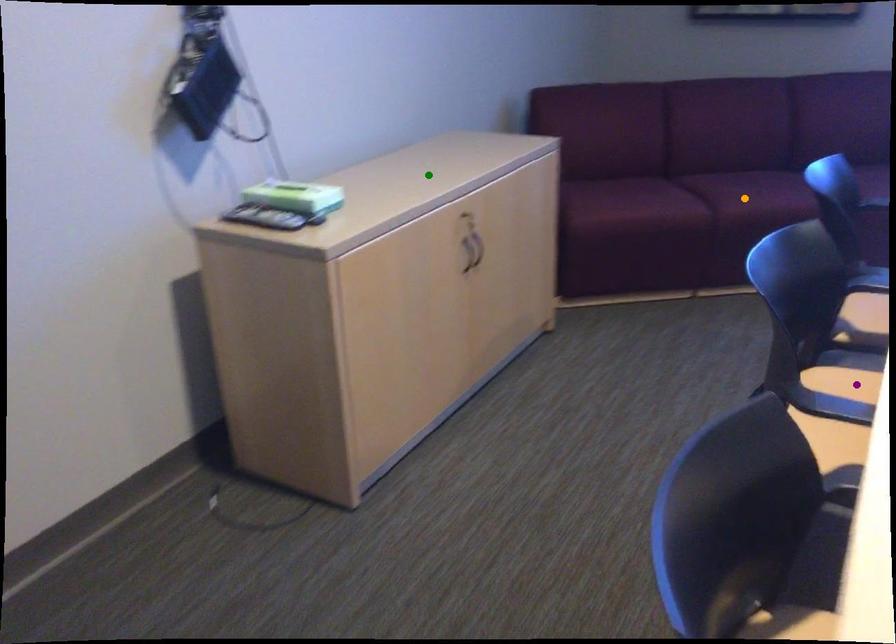
Order these from nearest to farthest:
orange point, purple point, green point

purple point < green point < orange point